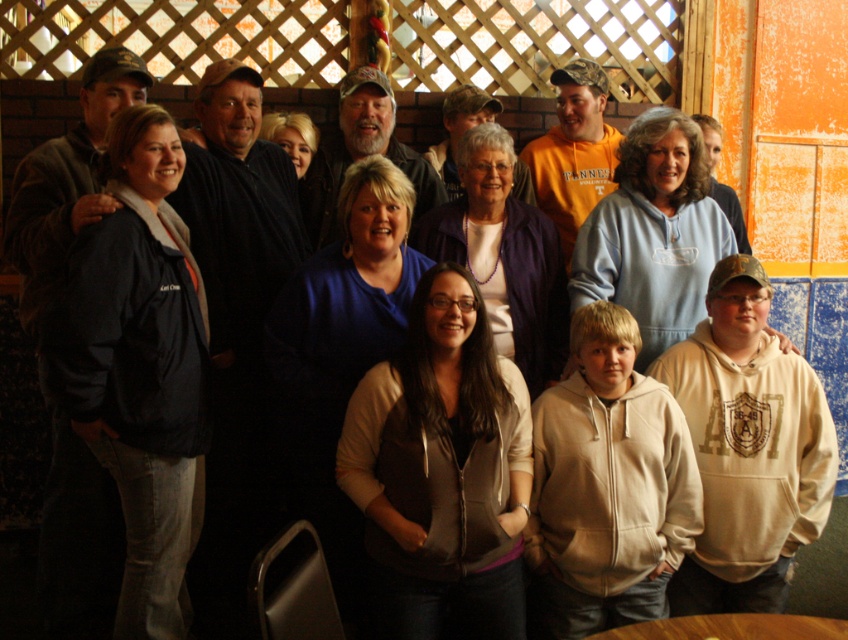
Is dark blue jacket at left above light blue fleece at center?

No.

Based on the photo, is dark blue jacket at left to the right of light blue fleece at center from the viewer's perspective?

No, dark blue jacket at left is not to the right of light blue fleece at center.

Is point (123, 221) farther from viewer compared to point (674, 128)?

No, it is not.

The height and width of the screenshot is (640, 848). I want to click on dark blue jacket at left, so click(x=138, y=365).

Which is more to the left, light blue fleece at center or purple fabric at center?

purple fabric at center

Which is more to the right, light blue fleece at center or purple fabric at center?

light blue fleece at center is more to the right.

Between point (651, 118) and point (473, 228), which one is positioned in front?

Point (651, 118) is in front.

What are the coordinates of `light blue fleece at center` in the screenshot? It's located at (653, 232).

Does point (165, 541) come behind point (445, 266)?

No, it is in front of (445, 266).

The height and width of the screenshot is (640, 848). In order to click on dark blue jacket at left in this screenshot , I will do `click(138, 365)`.